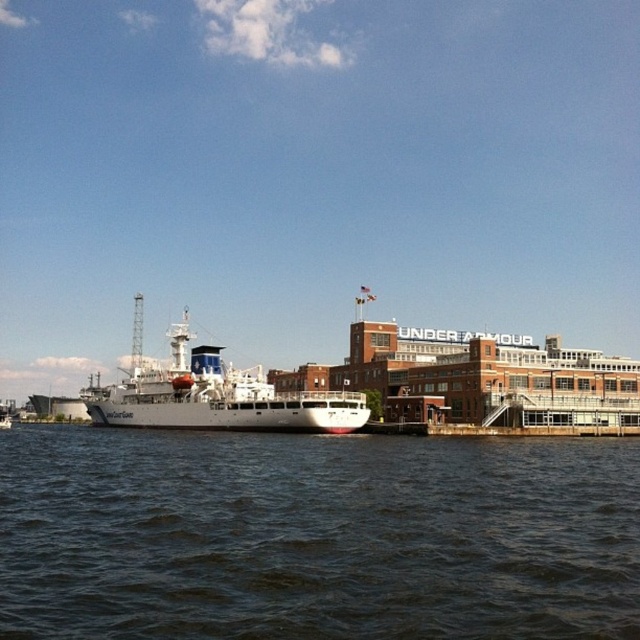
Consider the image. How much distance is there between dark blue water at lower center and white matte ship at center?

dark blue water at lower center and white matte ship at center are 35.02 meters apart.

Does point (497, 464) come farther from viewer compared to point (308, 422)?

No, it is not.

Between point (458, 612) and point (198, 397), which one is positioned behind?

The point (198, 397) is behind.

The width and height of the screenshot is (640, 640). What are the coordinates of `dark blue water at lower center` in the screenshot? It's located at (316, 536).